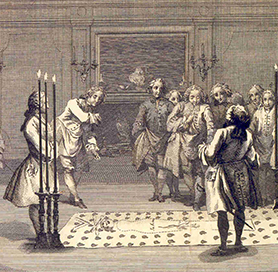
Find the location of a particular element. 2 colors on rug is located at coordinates (188, 245), (196, 240).